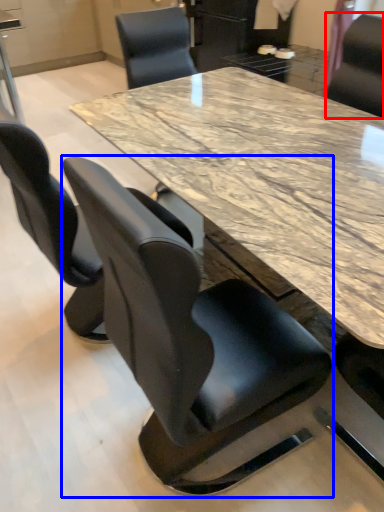
Question: Which object appears closest to the camera in this image, chair (highlighted by a red box) or chair (highlighted by a blue box)?

Choices:
 (A) chair
 (B) chair

Answer: (B)